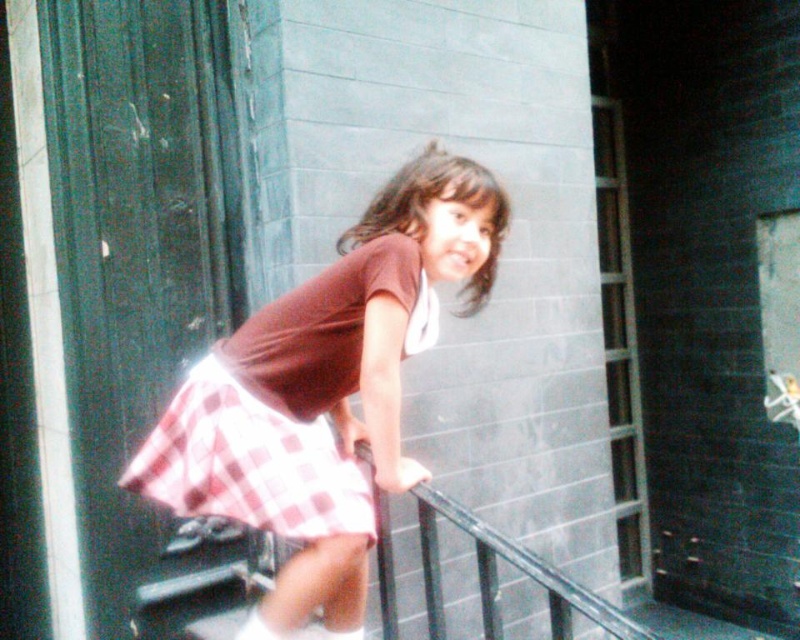
Which of these two, pink checkered skirt at center or red checkered skirt at center, stands taller?

With more height is pink checkered skirt at center.

Which of these two, pink checkered skirt at center or red checkered skirt at center, stands shorter?

With less height is red checkered skirt at center.

Does point (337, 376) lie in front of point (206, 464)?

No.

At what (x,y) coordinates should I click in order to perform the action: click on pink checkered skirt at center. Please return your answer as a coordinate pair (x, y). The image size is (800, 640). Looking at the image, I should click on (326, 390).